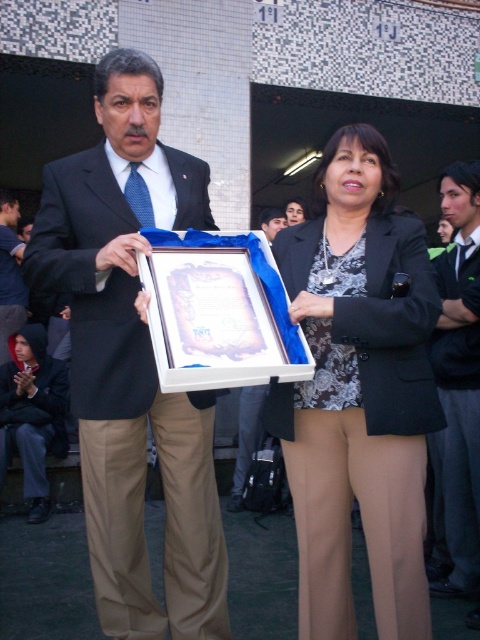
Can you confirm if matte black suit at left is shorter than matte black frame at center?

Incorrect, matte black suit at left's height does not fall short of matte black frame at center's.

Which is more to the left, matte black suit at left or matte black frame at center?

matte black suit at left is more to the left.

Where is `matte black suit at left`? The image size is (480, 640). matte black suit at left is located at coordinates (10, 275).

Who is higher up, matte black suit at center or matte black blazer at center?

matte black suit at center

Is matte black suit at center above matte black blazer at center?

Indeed, matte black suit at center is positioned over matte black blazer at center.

Find the location of a particular element. matte black suit at center is located at coordinates (132, 360).

Which is in front, point (144, 419) or point (249, 388)?

Point (144, 419) is in front.

You are a GUI agent. You are given a task and a screenshot of the screen. Output one action in this format:
    pyautogui.click(x=<x>, y=<y>)
    Task: Click on the matte black suit at center
    The image size is (480, 640).
    Given the screenshot: What is the action you would take?
    pyautogui.click(x=132, y=360)